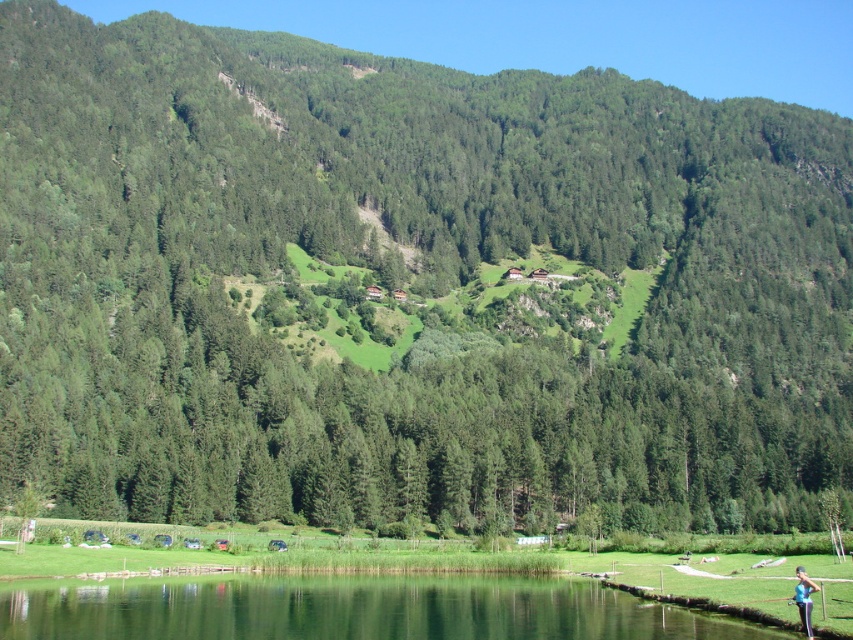
Question: Among these points, which one is nearest to the camera?

Choices:
 (A) (80, 621)
 (B) (805, 621)

Answer: (B)

Question: From the image, what is the correct spatial relationship of green smooth water at lower center in relation to blue fabric person at lower right?

Choices:
 (A) above
 (B) below

Answer: (B)

Question: Which of the following is the farthest from the observer?

Choices:
 (A) (752, 628)
 (B) (804, 572)

Answer: (B)

Question: Is green smooth water at lower center to the right of blue fabric person at lower right from the viewer's perspective?

Choices:
 (A) no
 (B) yes

Answer: (A)

Question: Which object appears closest to the camera in this image?

Choices:
 (A) green smooth water at lower center
 (B) blue fabric person at lower right

Answer: (A)

Question: Does green smooth water at lower center appear over blue fabric person at lower right?

Choices:
 (A) yes
 (B) no

Answer: (B)